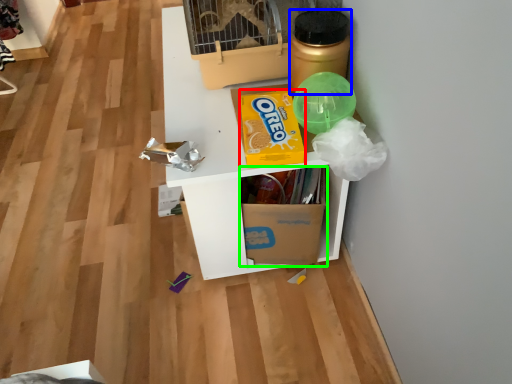
Question: Which object is positioned closest to cereal (highlighted by a red box)? Select from bottle (highlighted by a blue box) and cardboard box (highlighted by a green box).

Choices:
 (A) bottle
 (B) cardboard box

Answer: (A)